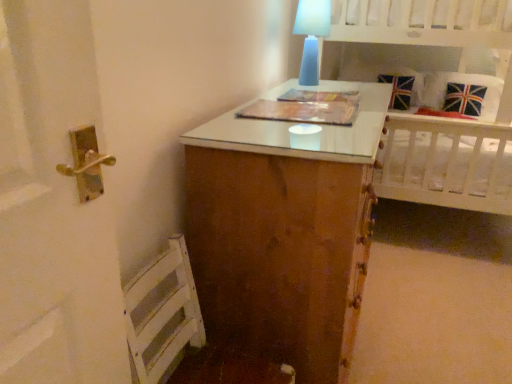
This screenshot has width=512, height=384. In order to click on union jack fabric pillow at upper right in this screenshot , I will do `click(463, 94)`.

Image resolution: width=512 pixels, height=384 pixels. Describe the element at coordinates (463, 94) in the screenshot. I see `union jack fabric pillow at upper right` at that location.

Where is `blue frosted glass table lamp at upper center`? blue frosted glass table lamp at upper center is located at coordinates (311, 36).

What do you see at coordinates (311, 36) in the screenshot? I see `blue frosted glass table lamp at upper center` at bounding box center [311, 36].

Locate an element on the screen. Image resolution: width=512 pixels, height=384 pixels. white wooden bed at upper right is located at coordinates click(438, 95).

How different are the orientations of white wooden bed at upper right and union jack fabric pillow at upper right in degrees?

0.255 degrees.

From a real-world perspective, is white wooden bed at upper right located beneath union jack fabric pillow at upper right?

Actually, white wooden bed at upper right is physically above union jack fabric pillow at upper right in the real world.

Does point (446, 30) come closer to viewer compared to point (425, 101)?

Yes.

Would you say white wooden bed at upper right contains union jack fabric pillow at upper right?

Indeed, union jack fabric pillow at upper right is located within white wooden bed at upper right.

I want to click on pillow on the right of white wooden bed at upper right, so click(x=463, y=94).

Considering the positions of objects union jack fabric pillow at upper right and white wooden bed at upper right in the image provided, who is more to the right, union jack fabric pillow at upper right or white wooden bed at upper right?

union jack fabric pillow at upper right.

Does union jack fabric pillow at upper right have a greater width compared to white wooden bed at upper right?

In fact, union jack fabric pillow at upper right might be narrower than white wooden bed at upper right.

Would you say blue frosted glass table lamp at upper center is a long distance from union jack fabric pillow at upper right?

Absolutely, blue frosted glass table lamp at upper center is distant from union jack fabric pillow at upper right.

What's the angular difference between blue frosted glass table lamp at upper center and union jack fabric pillow at upper right's facing directions?

The angular difference between blue frosted glass table lamp at upper center and union jack fabric pillow at upper right is 89.7 degrees.

Is blue frosted glass table lamp at upper center smaller than union jack fabric pillow at upper right?

Indeed, blue frosted glass table lamp at upper center has a smaller size compared to union jack fabric pillow at upper right.

Between point (304, 13) and point (484, 104), which one is positioned behind?

The point (484, 104) is farther.

Is blue frosted glass table lamp at upper center positioned behind white wooden bed at upper right?

Yes.

From the image's perspective, which one is positioned higher, blue frosted glass table lamp at upper center or white wooden bed at upper right?

blue frosted glass table lamp at upper center.

From the picture: Could you tell me if blue frosted glass table lamp at upper center is facing white wooden bed at upper right?

No.

What's the angular difference between blue frosted glass table lamp at upper center and white wooden bed at upper right's facing directions?

They differ by 90 degrees in their facing directions.

How many degrees apart are the facing directions of union jack fabric pillow at upper right and blue frosted glass table lamp at upper center?

They differ by 89.7 degrees in their facing directions.

Are union jack fabric pillow at upper right and blue frosted glass table lamp at upper center located far from each other?

Yes.

Can you confirm if union jack fabric pillow at upper right is shorter than blue frosted glass table lamp at upper center?

No, union jack fabric pillow at upper right is not shorter than blue frosted glass table lamp at upper center.

Which of these two, union jack fabric pillow at upper right or blue frosted glass table lamp at upper center, is smaller?

With smaller size is blue frosted glass table lamp at upper center.

In order to click on bed to the right of blue frosted glass table lamp at upper center in this screenshot , I will do `click(438, 95)`.

Is white wooden bed at upper right bigger than blue frosted glass table lamp at upper center?

Yes.

Can you confirm if white wooden bed at upper right is positioned to the right of blue frosted glass table lamp at upper center?

Correct, you'll find white wooden bed at upper right to the right of blue frosted glass table lamp at upper center.

Choose the correct answer: Is white wooden bed at upper right inside blue frosted glass table lamp at upper center or outside it?

white wooden bed at upper right is located beyond the bounds of blue frosted glass table lamp at upper center.

The width and height of the screenshot is (512, 384). I want to click on bed that appears on the left of union jack fabric pillow at upper right, so click(x=438, y=95).

Where is `pillow to the right of white wooden bed at upper right`? The width and height of the screenshot is (512, 384). pillow to the right of white wooden bed at upper right is located at coordinates (463, 94).

In the scene shown: Looking at the image, which one is located further to white wooden bed at upper right, union jack fabric pillow at upper right or blue frosted glass table lamp at upper center?

blue frosted glass table lamp at upper center is positioned further to the anchor white wooden bed at upper right.

Based on their spatial positions, is blue frosted glass table lamp at upper center or union jack fabric pillow at upper right closer to white wooden bed at upper right?

Among the two, union jack fabric pillow at upper right is located nearer to white wooden bed at upper right.

From the image, which object appears to be nearer to blue frosted glass table lamp at upper center, white wooden bed at upper right or union jack fabric pillow at upper right?

white wooden bed at upper right is positioned closer to the anchor blue frosted glass table lamp at upper center.

Based on their spatial positions, is union jack fabric pillow at upper right or white wooden bed at upper right closer to blue frosted glass table lamp at upper center?

white wooden bed at upper right is positioned closer to the anchor blue frosted glass table lamp at upper center.

Estimate the real-world distances between objects in this image. Which object is closer to union jack fabric pillow at upper right, blue frosted glass table lamp at upper center or white wooden bed at upper right?

white wooden bed at upper right is positioned closer to the anchor union jack fabric pillow at upper right.

Considering their positions, is white wooden bed at upper right positioned further to union jack fabric pillow at upper right than blue frosted glass table lamp at upper center?

blue frosted glass table lamp at upper center lies further to union jack fabric pillow at upper right than the other object.

The height and width of the screenshot is (384, 512). In order to click on table lamp between white wooden bed at upper right and union jack fabric pillow at upper right from front to back in this screenshot , I will do `click(311, 36)`.